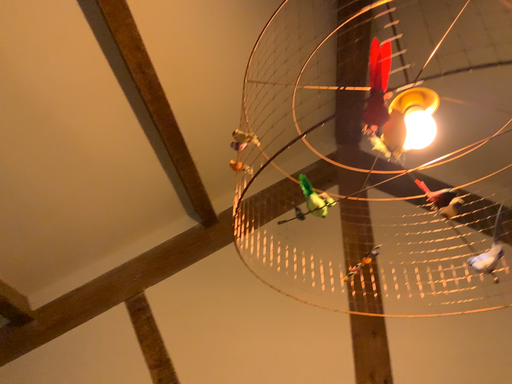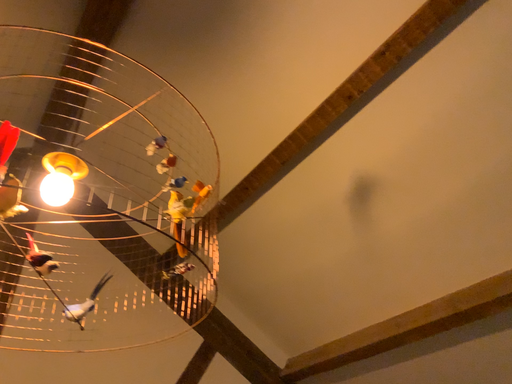
Question: Which way did the camera rotate in the video?

Choices:
 (A) rotated right
 (B) rotated left

Answer: (A)